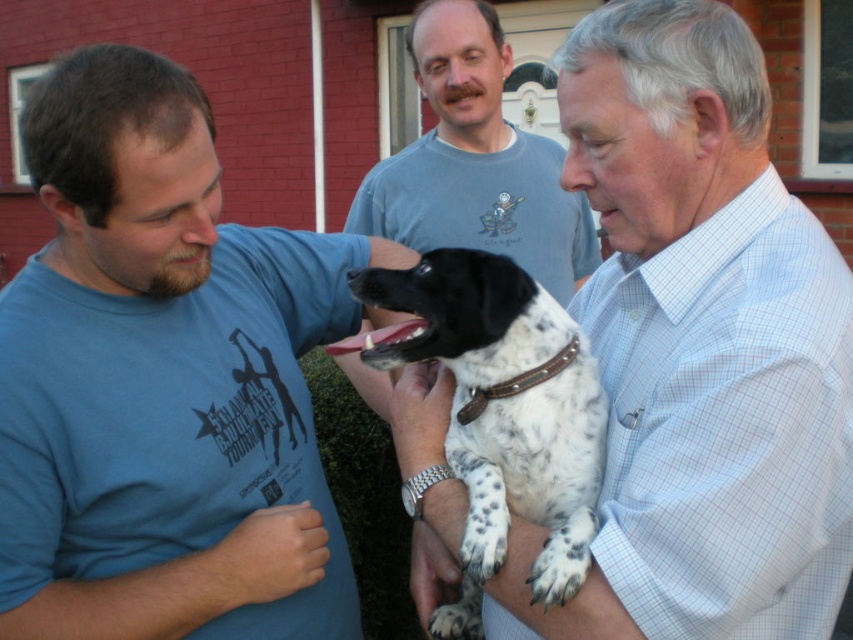
Is blue t-shirt at left to the right of spotted fur dog at center from the viewer's perspective?

No, blue t-shirt at left is not to the right of spotted fur dog at center.

Identify the location of blue t-shirt at left. This screenshot has height=640, width=853. (163, 381).

Is white checkered shirt at upper right shorter than spotted fur dog at center?

No.

Is white checkered shirt at upper right closer to camera compared to spotted fur dog at center?

Yes, it is.

Measure the distance between white checkered shirt at upper right and camera.

They are 37.94 inches apart.

The width and height of the screenshot is (853, 640). I want to click on white checkered shirt at upper right, so click(699, 348).

Does point (299, 582) lie in front of point (722, 525)?

No, it is not.

Between point (234, 497) and point (634, 518), which one is positioned in front?

Point (634, 518)

This screenshot has width=853, height=640. Find the location of `blue t-shirt at left`. blue t-shirt at left is located at coordinates pyautogui.click(x=163, y=381).